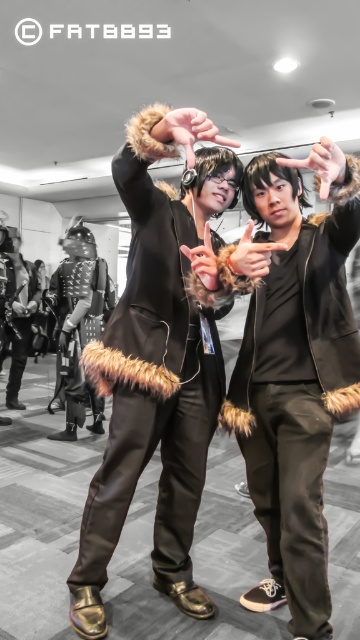
Which is behind, point (102, 310) or point (24, 355)?

The point (24, 355) is more distant.

Between point (83, 333) and point (10, 257), which one is positioned behind?

Positioned behind is point (10, 257).

Where is `studded leather armor at center`? This screenshot has height=640, width=360. studded leather armor at center is located at coordinates (79, 332).

Can you confirm if furry black jacket at center is smaller than studded leather armor at center?

Correct, furry black jacket at center occupies less space than studded leather armor at center.

Is furry black jacket at center thinner than studded leather armor at center?

Yes.

The width and height of the screenshot is (360, 640). What do you see at coordinates (294, 376) in the screenshot? I see `furry black jacket at center` at bounding box center [294, 376].

The height and width of the screenshot is (640, 360). I want to click on furry black jacket at center, so coord(294,376).

Can you confirm if fur-trimmed coat at center is shorter than velvet black vest at center?

In fact, fur-trimmed coat at center may be taller than velvet black vest at center.

Can you confirm if fur-trimmed coat at center is taller than velvet black vest at center?

Yes, fur-trimmed coat at center is taller than velvet black vest at center.

This screenshot has width=360, height=640. Describe the element at coordinates (151, 385) in the screenshot. I see `fur-trimmed coat at center` at that location.

The width and height of the screenshot is (360, 640). I want to click on fur-trimmed coat at center, so click(x=151, y=385).